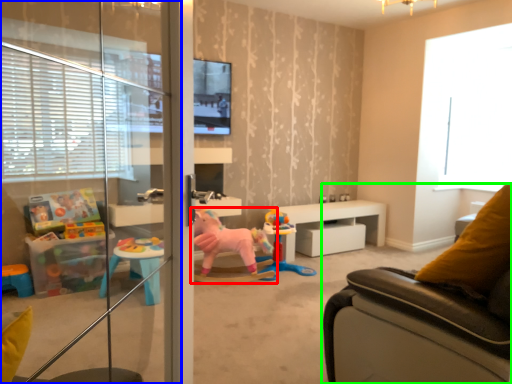
Question: Which object is the closest to the toy (highlighted by a red box)? Choose among these: screen door (highlighted by a blue box) or studio couch (highlighted by a green box).

Choices:
 (A) screen door
 (B) studio couch

Answer: (A)